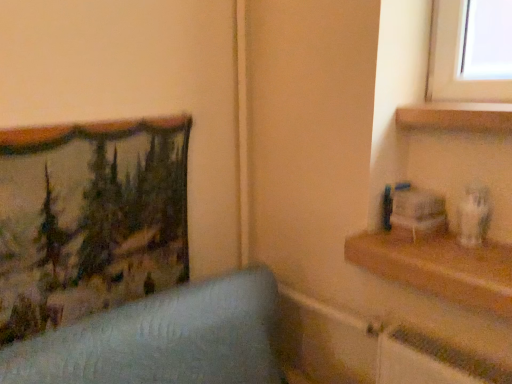
At what (x,y) coordinates should I click in order to perform the action: click on empty space that is ontop of wooden shelf at right, the second shelf when ordered from top to bottom (from a real-world perspective). Please return your answer as a coordinate pair (x, y). This screenshot has width=512, height=384. Looking at the image, I should click on (439, 244).